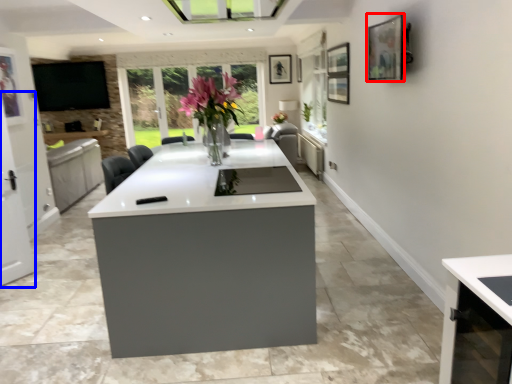
Question: Which object is closer to the camera taking this photo, picture frame (highlighted by a red box) or screen door (highlighted by a blue box)?

Choices:
 (A) picture frame
 (B) screen door

Answer: (A)